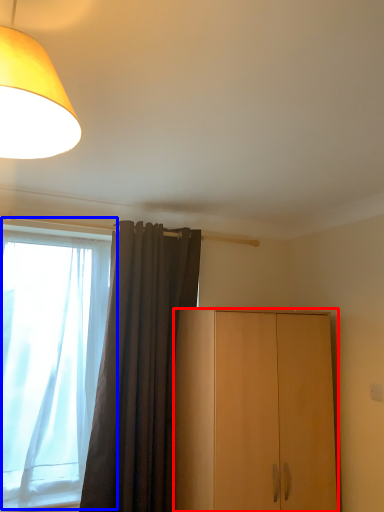
Question: Among these objects, which one is farthest to the camera, cabinetry (highlighted by a red box) or window (highlighted by a blue box)?

Choices:
 (A) cabinetry
 (B) window

Answer: (B)